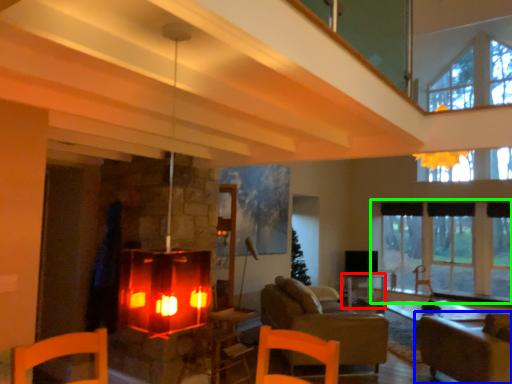
Question: Based on their relative distances, which object is farther from table (highlighted by a red box)? Choose from armchair (highlighted by a blue box) and window (highlighted by a green box).

Choices:
 (A) armchair
 (B) window

Answer: (A)